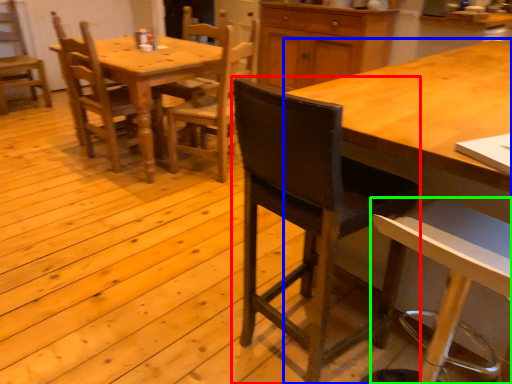
Question: Considering the real-world distances, which object is closest to chair (highlighted by a red box)? desk (highlighted by a blue box) or chair (highlighted by a green box).

Choices:
 (A) desk
 (B) chair

Answer: (B)